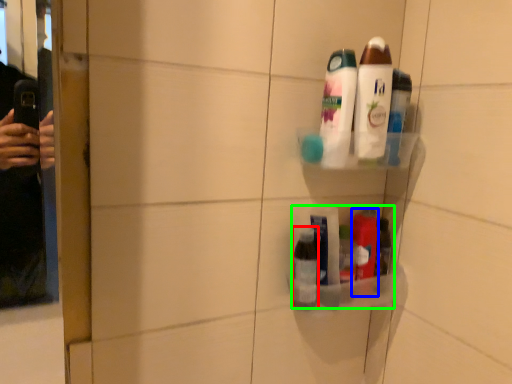
Question: Which is farther away from toiletry (highlighted by a red box)? toiletry (highlighted by a blue box) or product (highlighted by a green box)?

Choices:
 (A) toiletry
 (B) product

Answer: (A)